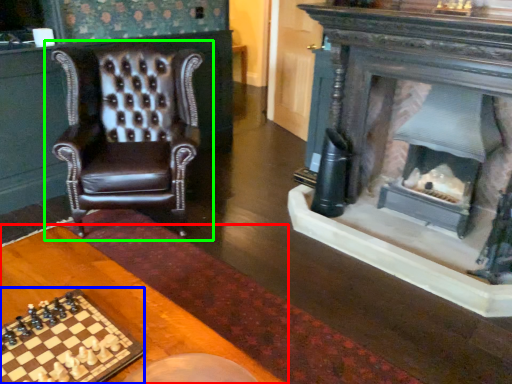
Question: Considering the real-world distances, which object is farthest from table (highlighted by a red box)? board game (highlighted by a blue box) or chair (highlighted by a green box)?

Choices:
 (A) board game
 (B) chair

Answer: (B)